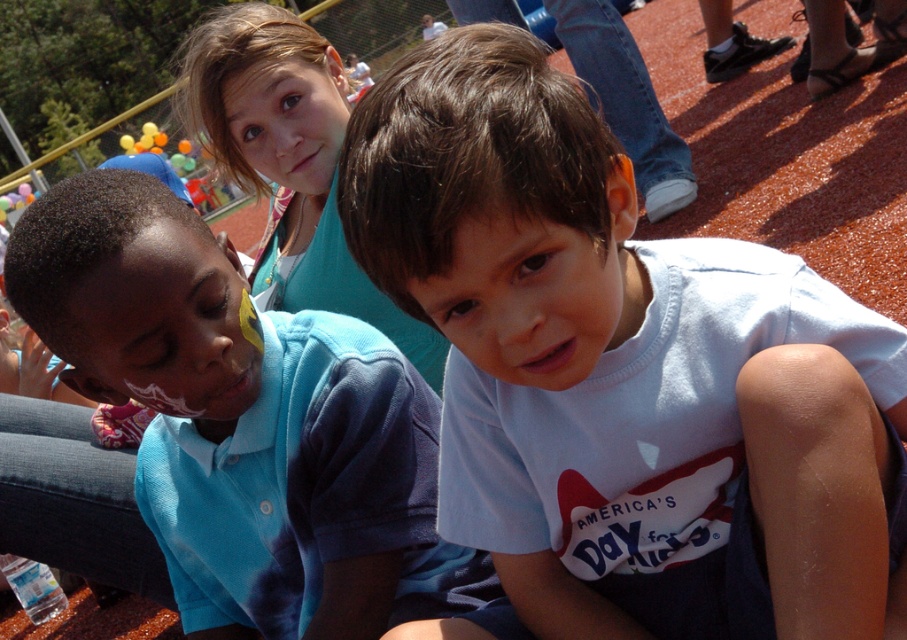
Which is in front, point (457, 625) or point (247, 362)?

Point (457, 625) is more forward.

Does white cotton shirt at center have a greater width compared to blue tie-dye polo shirt at left?

Incorrect, white cotton shirt at center's width does not surpass blue tie-dye polo shirt at left's.

Find the location of a particular element. white cotton shirt at center is located at coordinates (621, 372).